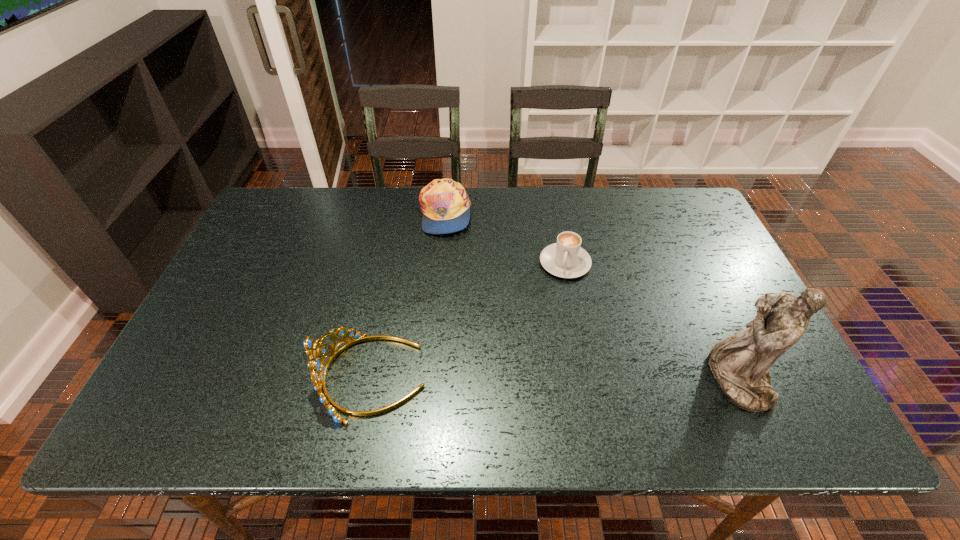
The width and height of the screenshot is (960, 540). Find the location of `figurine situated at the near edge`. figurine situated at the near edge is located at coordinates (740, 363).

This screenshot has width=960, height=540. In order to click on object present at the right edge in this screenshot , I will do `click(740, 363)`.

I want to click on object that is at the near right corner, so click(x=740, y=363).

At what (x,y) coordinates should I click in order to perform the action: click on vacant area at the far edge. Please return your answer as a coordinate pair (x, y). Looking at the image, I should click on (604, 229).

Locate an element on the screen. vacant space at the left edge of the desktop is located at coordinates (241, 305).

Locate an element on the screen. free space at the right edge of the desktop is located at coordinates (733, 272).

In the image, there is a desktop. Where is `vacant space at the far left corner`? This screenshot has height=540, width=960. vacant space at the far left corner is located at coordinates (285, 212).

In the image, there is a desktop. At what (x,y) coordinates should I click in order to perform the action: click on free space at the far right corner. Please return your answer as a coordinate pair (x, y). Looking at the image, I should click on (682, 222).

At what (x,y) coordinates should I click in order to perform the action: click on vacant space that is in between the third shortest object and the second object from right to left. Please return your answer as a coordinate pair (x, y). Looking at the image, I should click on (468, 320).

In order to click on vacant area that lies between the tallest object and the second tallest object in this screenshot , I will do `click(555, 378)`.